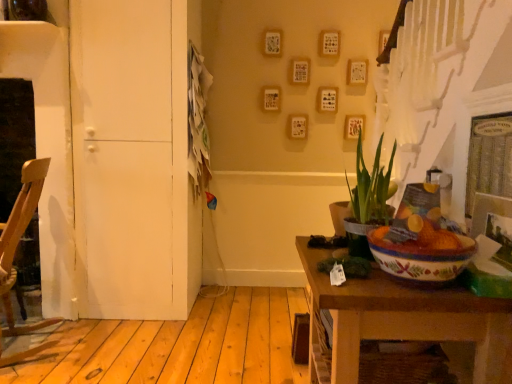
In the scene shown: What is the approximate width of green leafy plant at center?

green leafy plant at center is 7.45 inches in width.

This screenshot has height=384, width=512. I want to click on green leafy plant at center, so (368, 200).

Is wooden chair at left to the left or to the right of white matte door at left in the image?

Based on their positions, wooden chair at left is located to the left of white matte door at left.

Does wooden chair at left come behind white matte door at left?

No, wooden chair at left is in front of white matte door at left.

Who is taller, wooden chair at left or white matte door at left?

Standing taller between the two is white matte door at left.

Does point (47, 320) appear closer or farther from the camera than point (154, 263)?

Point (47, 320) is closer to the camera than point (154, 263).

From the image's perspective, relative to wooden chair at left, is green leafy plant at center above or below?

From the image's perspective, green leafy plant at center appears above wooden chair at left.

Which object is further away from the camera, green leafy plant at center or wooden chair at left?

wooden chair at left is further away from the camera.

Would you say green leafy plant at center is outside wooden chair at left?

Absolutely, green leafy plant at center is external to wooden chair at left.

Where is `chair lying on the left of green leafy plant at center`? This screenshot has height=384, width=512. chair lying on the left of green leafy plant at center is located at coordinates click(x=20, y=238).

Is green leafy plant at center aimed at white matte door at left?

No, green leafy plant at center is not turned towards white matte door at left.

Can you tell me how much green leafy plant at center and white matte door at left differ in facing direction?

green leafy plant at center and white matte door at left are facing 89.7 degrees away from each other.

You are a GUI agent. You are given a task and a screenshot of the screen. Output one action in this format:
    pyautogui.click(x=<x>, y=<y>)
    Task: Click on the houseplant to the right of white matte door at left
    Image resolution: width=512 pixels, height=384 pixels.
    Given the screenshot: What is the action you would take?
    click(368, 200)

Is wooden table at lower right directly adjacent to white matte door at left?

wooden table at lower right and white matte door at left are not in contact.

From their relative heights in the image, would you say wooden table at lower right is taller or shorter than white matte door at left?

Clearly, wooden table at lower right is shorter compared to white matte door at left.

From the image's perspective, is wooden table at lower right positioned above or below white matte door at left?

Based on their image positions, wooden table at lower right is located beneath white matte door at left.

From the image's perspective, does wooden table at lower right appear lower than wooden chair at left?

Yes.

Is there a large distance between wooden table at lower right and wooden chair at left?

Indeed, wooden table at lower right is not near wooden chair at left.

Do you think wooden table at lower right is within wooden chair at left, or outside of it?

wooden table at lower right lies outside wooden chair at left.

Is wooden table at lower right looking in the opposite direction of wooden chair at left?

wooden table at lower right does not have its back to wooden chair at left.

Identify the location of door on the left of the green leafy plant at center. The width and height of the screenshot is (512, 384). (134, 158).

Does white matte door at left have a smaller size compared to green leafy plant at center?

No.

What's the angular difference between white matte door at left and green leafy plant at center's facing directions?

89.7 degrees separate the facing orientations of white matte door at left and green leafy plant at center.

From the image's perspective, which is above, white matte door at left or green leafy plant at center?

From the image's view, white matte door at left is above.

Considering the sizes of objects wooden chair at left and wooden table at lower right in the image provided, who is smaller, wooden chair at left or wooden table at lower right?

wooden table at lower right.

Identify the location of chair lying behind the wooden table at lower right. (20, 238).

Considering the positions of objects wooden chair at left and wooden table at lower right in the image provided, who is more to the right, wooden chair at left or wooden table at lower right?

Positioned to the right is wooden table at lower right.

From the picture: Is wooden chair at left positioned far away from wooden table at lower right?

wooden chair at left is far away from wooden table at lower right.

Find the location of a particular element. Image resolution: width=512 pixels, height=384 pixels. chair below the white matte door at left (from the image's perspective) is located at coordinates (20, 238).

There is a wooden chair at left. Where is `houseplant above it (from a real-world perspective)`? The width and height of the screenshot is (512, 384). houseplant above it (from a real-world perspective) is located at coordinates tap(368, 200).

Estimate the real-world distances between objects in this image. Which object is further from wooden chair at left, white matte door at left or green leafy plant at center?

green leafy plant at center lies further to wooden chair at left than the other object.

Based on their spatial positions, is wooden table at lower right or white matte door at left closer to green leafy plant at center?

The object closer to green leafy plant at center is wooden table at lower right.

Looking at the image, which one is located closer to wooden chair at left, wooden table at lower right or white matte door at left?

white matte door at left is positioned closer to the anchor wooden chair at left.

Considering their positions, is green leafy plant at center positioned closer to wooden chair at left than wooden table at lower right?

green leafy plant at center is closer to wooden chair at left.

Which object lies further to the anchor point wooden chair at left, green leafy plant at center or white matte door at left?

green leafy plant at center is further to wooden chair at left.

Based on their spatial positions, is wooden table at lower right or green leafy plant at center closer to wooden chair at left?

Among the two, green leafy plant at center is located nearer to wooden chair at left.

Based on their spatial positions, is wooden chair at left or green leafy plant at center closer to white matte door at left?

Among the two, wooden chair at left is located nearer to white matte door at left.

When comparing their distances from green leafy plant at center, does white matte door at left or wooden chair at left seem further?

Based on the image, wooden chair at left appears to be further to green leafy plant at center.

The height and width of the screenshot is (384, 512). In order to click on houseplant located between wooden table at lower right and white matte door at left in the depth direction in this screenshot , I will do `click(368, 200)`.

Where is `door between wooden chair at left and wooden table at lower right in the horizontal direction`? door between wooden chair at left and wooden table at lower right in the horizontal direction is located at coordinates (134, 158).

Identify the location of houseplant between wooden chair at left and wooden table at lower right. (368, 200).

The width and height of the screenshot is (512, 384). In order to click on door situated between wooden chair at left and green leafy plant at center from left to right in this screenshot , I will do `click(134, 158)`.